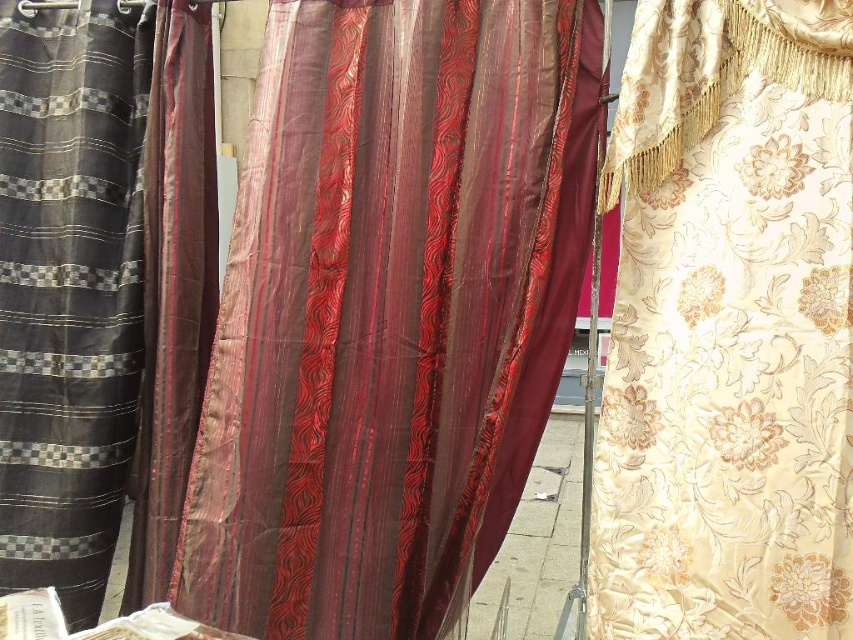
You are a customer at a fabric store. You want to buy a fabric that is larger in size between the gold floral fabric at right and the silky striped fabric at left. Which one should you choose?

The gold floral fabric at right is bigger than the silky striped fabric at left, so you should choose the gold floral fabric at right.

What is the width comparison between the shiny silk curtain at center and the gold floral fabric at right?

The shiny silk curtain at center is wider than the gold floral fabric at right.